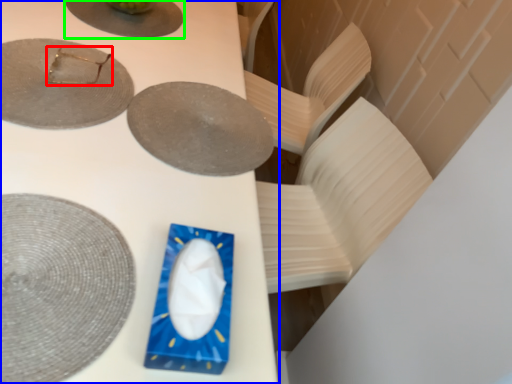
Question: Estimate the real-world distances between objects in this image. Which object is closer to tableware (highlighted by a red box), table (highlighted by a blue box) or plate (highlighted by a green box)?

Choices:
 (A) table
 (B) plate

Answer: (B)